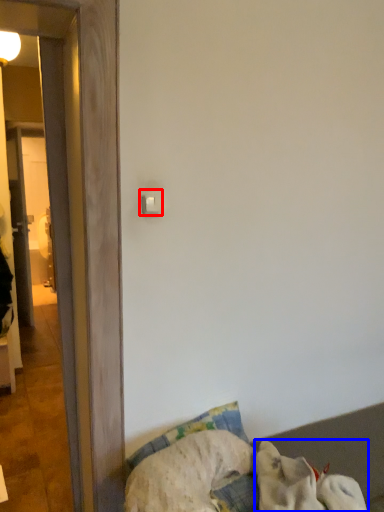
Question: Among these objects, which one is nearest to the camera, light switch (highlighted by a red box) or dog (highlighted by a blue box)?

Choices:
 (A) light switch
 (B) dog

Answer: (B)